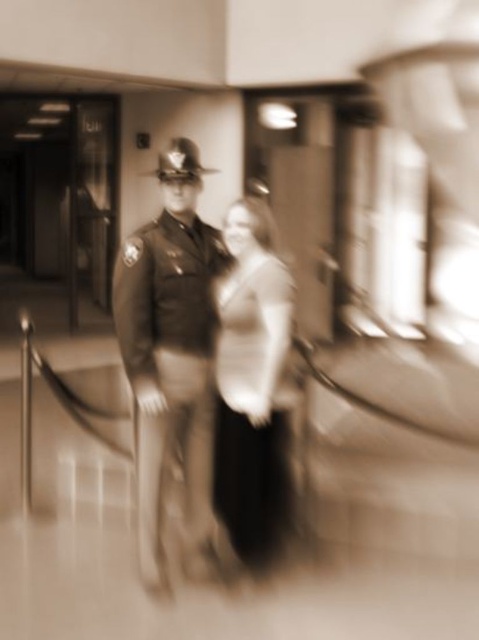
Does point (160, 548) come behind point (280, 298)?

That is True.

Who is lower down, uniformed officer at center or matte white blouse at center?

Positioned lower is matte white blouse at center.

Locate an element on the screen. The height and width of the screenshot is (640, 479). uniformed officer at center is located at coordinates (171, 348).

Where is `uniformed officer at center`? The width and height of the screenshot is (479, 640). uniformed officer at center is located at coordinates (171, 348).